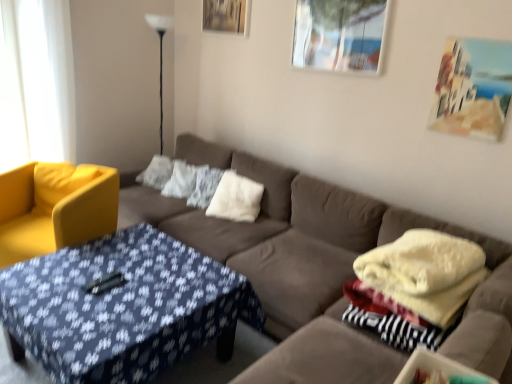
Question: Is black glass floor lamp at upper left to the right of white fluffy pillow at center, the third pillow in the left-to-right sequence, from the viewer's perspective?

Choices:
 (A) yes
 (B) no

Answer: (B)

Question: From the image's perspective, does black glass floor lamp at upper left appear lower than white fluffy pillow at center, the 1th pillow viewed from the right?

Choices:
 (A) no
 (B) yes

Answer: (A)

Question: From a real-world perspective, does black glass floor lamp at upper left stand above white fluffy pillow at center, the 1th pillow viewed from the right?

Choices:
 (A) no
 (B) yes

Answer: (B)

Question: Is black glass floor lamp at upper left to the left of white fluffy pillow at center, the 1th pillow viewed from the right, from the viewer's perspective?

Choices:
 (A) yes
 (B) no

Answer: (A)

Question: Does black glass floor lamp at upper left have a lesser width compared to white fluffy pillow at center, the 1th pillow viewed from the right?

Choices:
 (A) no
 (B) yes

Answer: (B)

Question: In the image, is wooden picture frame at upper center, positioned as the third picture frame in bottom-to-top order, on the left side or the right side of metallic glass picture frame at upper right, positioned as the second picture frame in bottom-to-top order?

Choices:
 (A) left
 (B) right

Answer: (A)

Question: Is wooden picture frame at upper center, positioned as the third picture frame in bottom-to-top order, inside or outside of metallic glass picture frame at upper right, positioned as the second picture frame in back-to-front order?

Choices:
 (A) outside
 (B) inside

Answer: (A)

Question: From the image's perspective, is wooden picture frame at upper center, the 3th picture frame positioned from the right, located above or below metallic glass picture frame at upper right, which is the second picture frame in right-to-left order?

Choices:
 (A) below
 (B) above

Answer: (B)

Question: Considering the positions of wooden picture frame at upper center, which appears as the 1th picture frame when viewed from the back, and metallic glass picture frame at upper right, positioned as the second picture frame in bottom-to-top order, in the image, is wooden picture frame at upper center, which appears as the 1th picture frame when viewed from the back, bigger or smaller than metallic glass picture frame at upper right, positioned as the second picture frame in bottom-to-top order,?

Choices:
 (A) small
 (B) big

Answer: (A)

Question: From a real-world perspective, relative to metallic glass picture frame at upper right, positioned as the second picture frame in back-to-front order, is white fluffy pillow at center, the third pillow in the left-to-right sequence, vertically above or below?

Choices:
 (A) below
 (B) above

Answer: (A)

Question: In terms of width, does white fluffy pillow at center, the third pillow in the left-to-right sequence, look wider or thinner when compared to metallic glass picture frame at upper right, which is the second picture frame in right-to-left order?

Choices:
 (A) thin
 (B) wide

Answer: (B)

Question: Looking at the image, does white fluffy pillow at center, the third pillow in the left-to-right sequence, seem bigger or smaller compared to metallic glass picture frame at upper right, which ranks as the 2th picture frame in left-to-right order?

Choices:
 (A) big
 (B) small

Answer: (A)

Question: Is white fluffy pillow at center, the 1th pillow viewed from the right, in front of or behind metallic glass picture frame at upper right, which ranks as the 2th picture frame in left-to-right order, in the image?

Choices:
 (A) front
 (B) behind

Answer: (B)

Question: Based on their positions, is black glass floor lamp at upper left located to the left or right of wooden picture frame at upper center, positioned as the third picture frame in bottom-to-top order?

Choices:
 (A) left
 (B) right

Answer: (A)

Question: Is point (160, 152) positioned closer to the camera than point (230, 29)?

Choices:
 (A) farther
 (B) closer

Answer: (A)